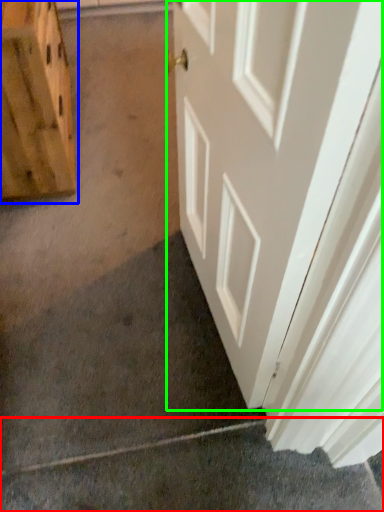
Question: Considering the real-world distances, which object is closest to concrete (highlighted by a red box)? cabinetry (highlighted by a blue box) or door (highlighted by a green box).

Choices:
 (A) cabinetry
 (B) door

Answer: (B)